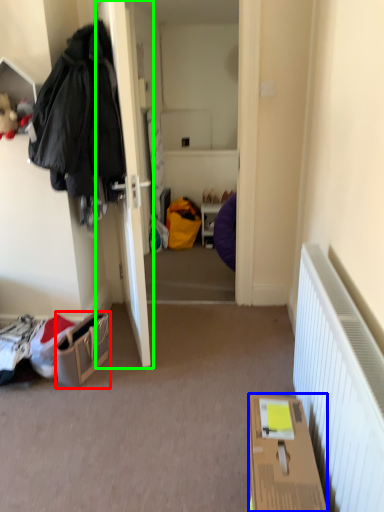
Question: Which is nearer to the handbag (highlighted by a red box)? box (highlighted by a blue box) or door (highlighted by a green box).

Choices:
 (A) box
 (B) door

Answer: (B)